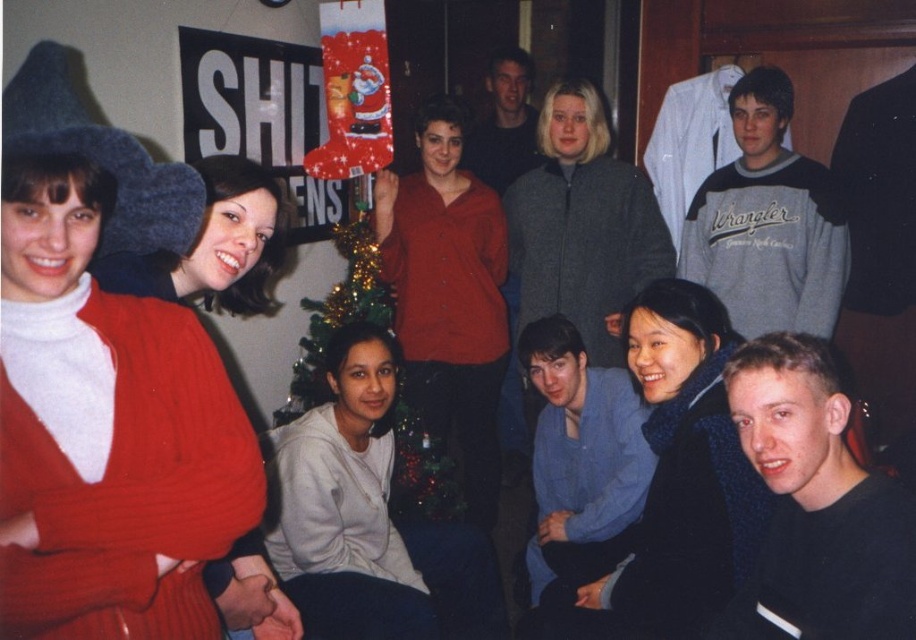
Measure the distance from gray/black sweatshirt at upper right to smooth gray sweater at upper center.

The distance of gray/black sweatshirt at upper right from smooth gray sweater at upper center is 1.38 meters.

Based on the photo, is gray/black sweatshirt at upper right positioned in front of smooth gray sweater at upper center?

Yes, gray/black sweatshirt at upper right is in front of smooth gray sweater at upper center.

What do you see at coordinates (767, 221) in the screenshot?
I see `gray/black sweatshirt at upper right` at bounding box center [767, 221].

Identify the location of gray/black sweatshirt at upper right. (767, 221).

In the scene shown: Which is below, black matte shirt at lower right or gray/black sweatshirt at upper right?

black matte shirt at lower right is below.

Is black matte shirt at lower right positioned before gray/black sweatshirt at upper right?

Yes, it is.

Based on the photo, measure the distance between point (x=722, y=618) and camera.

A distance of 1.62 meters exists between point (x=722, y=618) and camera.

Identify the location of black matte shirt at lower right. This screenshot has height=640, width=916. (815, 506).

Between point (589, 468) and point (522, 109), which one is positioned behind?

Positioned behind is point (522, 109).

Based on the photo, does blue cotton shirt at center have a larger size compared to smooth gray sweater at upper center?

No, blue cotton shirt at center is not bigger than smooth gray sweater at upper center.

I want to click on blue cotton shirt at center, so click(x=581, y=458).